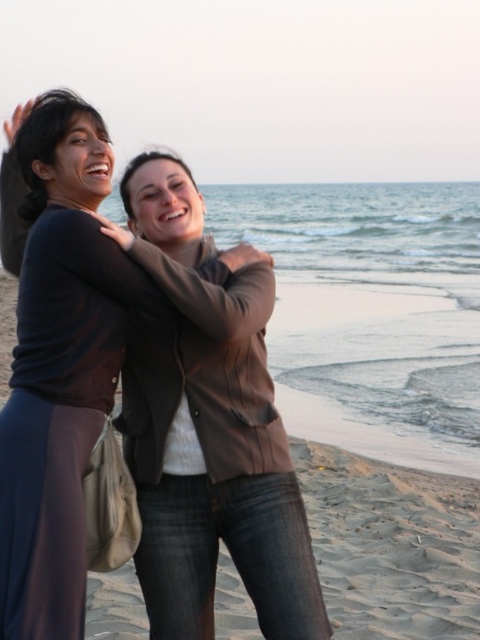
The image size is (480, 640). I want to click on matte brown jacket at center, so click(74, 317).

Which is more to the left, matte brown jacket at center or matte black hair at upper left?

From the viewer's perspective, matte black hair at upper left appears more on the left side.

I want to click on matte brown jacket at center, so click(74, 317).

Can you confirm if brown leather jacket at center is shorter than matte brown jacket at center?

Yes, brown leather jacket at center is shorter than matte brown jacket at center.

Who is lower down, brown leather jacket at center or matte brown jacket at center?

brown leather jacket at center is lower down.

Does point (183, 296) come behind point (68, 214)?

No, (183, 296) is in front of (68, 214).

In order to click on brown leather jacket at center in this screenshot , I will do `click(208, 432)`.

Which is below, brown leather jacket at center or matte black hair at upper left?

brown leather jacket at center is lower down.

Between point (199, 548) and point (71, 96), which one is positioned behind?

The point (199, 548) is more distant.

At what (x,y) coordinates should I click in order to perform the action: click on brown leather jacket at center. Please return your answer as a coordinate pair (x, y). Looking at the image, I should click on click(x=208, y=432).